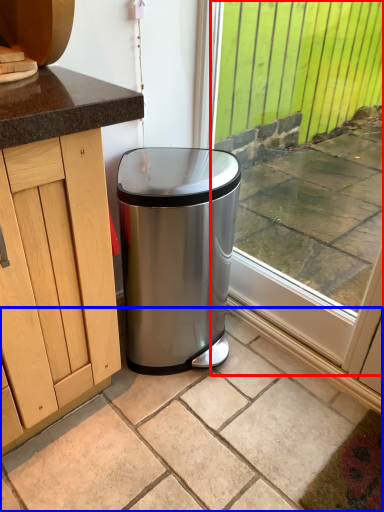
Question: Which object is closer to the camera taking this photo, window (highlighted by a red box) or granite (highlighted by a blue box)?

Choices:
 (A) window
 (B) granite

Answer: (B)